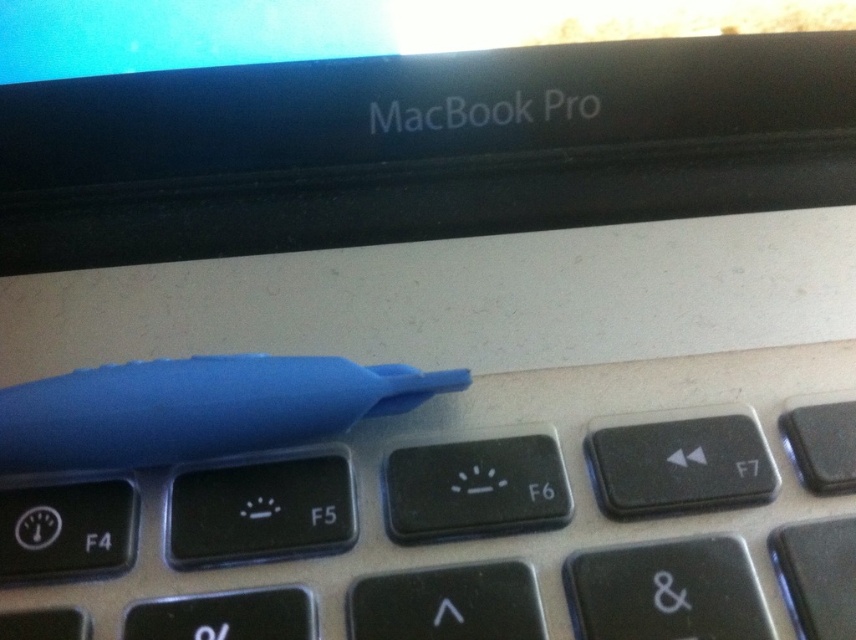
You are holding a small flashlight and want to shine it on both the point at location (x=756, y=368) and the point at (x=209, y=371) on the MacBook Pro keyboard. Which point should you aim the flashlight at first to ensure it reaches the closer one first?

You should aim the flashlight at point (x=209, y=371) first because it is closer to you than point (x=756, y=368), which is further away.

You are trying to open the laptop to replace the keyboard. You see the blue rubber pen at upper center and the blue rubber pen at center. Which pen is closer to the top edge of the laptop?

The blue rubber pen at center is closer to the top edge of the laptop because the blue rubber pen at upper center is located below it.

You are a technician trying to open a laptop. You have two blue rubber pens. One is at the upper center and the other at the center. The distance between them is 3.77 inches. If your hand can only reach 3 inches, can you comfortably use both blue rubber pen at upper center and blue rubber pen at center to pry open the laptop?

The blue rubber pen at upper center and blue rubber pen at center are 3.77 inches apart. Since your hand can only reach 3 inches, you cannot comfortably use both blue rubber pen at upper center and blue rubber pen at center to pry open the laptop because the distance between them exceeds your reach.